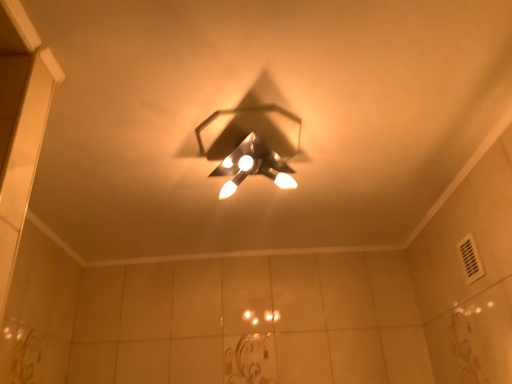
Measure the distance between point (261, 121) and camera.

A distance of 1.24 meters exists between point (261, 121) and camera.

Describe the element at coordinates (254, 139) in the screenshot. I see `metallic silver lamp at center` at that location.

The image size is (512, 384). I want to click on metallic silver lamp at center, so click(254, 139).

Identify the location of metallic silver lamp at center. The width and height of the screenshot is (512, 384). (254, 139).